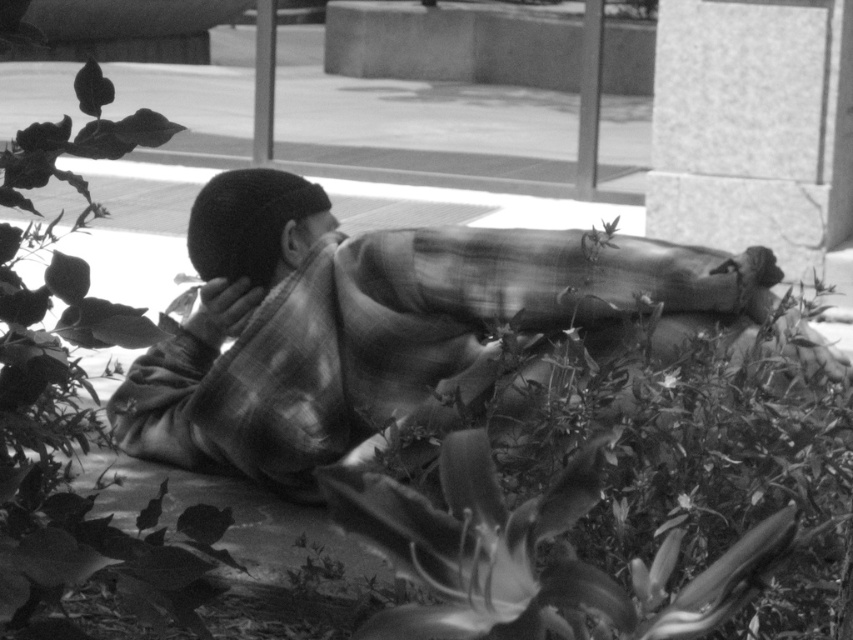
Does plaid fabric at center have a greater height compared to smooth skin face at center?

Yes, plaid fabric at center is taller than smooth skin face at center.

Can you confirm if plaid fabric at center is wider than smooth skin face at center?

Indeed, plaid fabric at center has a greater width compared to smooth skin face at center.

Does point (265, 444) come behind point (294, 228)?

No, (265, 444) is closer to viewer.

Locate an element on the screen. plaid fabric at center is located at coordinates (370, 323).

Is green leafy plant at center further to camera compared to smooth skin face at center?

No, green leafy plant at center is in front of smooth skin face at center.

Does green leafy plant at center have a lesser height compared to smooth skin face at center?

No.

Is point (485, 545) positioned behind point (334, 221)?

No, it is in front of (334, 221).

The width and height of the screenshot is (853, 640). I want to click on green leafy plant at center, so click(477, 547).

Between plaid fabric at center and green leafy plant at center, which one is positioned higher?

Positioned higher is plaid fabric at center.

Which of these two, plaid fabric at center or green leafy plant at center, stands taller?

Standing taller between the two is plaid fabric at center.

Is point (302, 460) positioned after point (397, 630)?

Yes, point (302, 460) is farther from viewer.

What are the coordinates of `plaid fabric at center` in the screenshot? It's located at [370, 323].